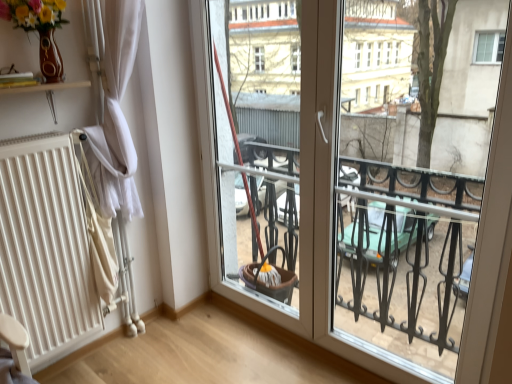
Question: Is white fabric curtain at left outside white matte radiator at left?

Choices:
 (A) no
 (B) yes

Answer: (B)

Question: Is white fabric curtain at left further to the viewer compared to white matte radiator at left?

Choices:
 (A) yes
 (B) no

Answer: (A)

Question: Considering the relative sizes of white fabric curtain at left and white matte radiator at left in the image provided, is white fabric curtain at left wider than white matte radiator at left?

Choices:
 (A) no
 (B) yes

Answer: (A)

Question: Can you confirm if white fabric curtain at left is shorter than white matte radiator at left?

Choices:
 (A) no
 (B) yes

Answer: (A)

Question: Is white fabric curtain at left oriented towards white matte radiator at left?

Choices:
 (A) yes
 (B) no

Answer: (B)

Question: From the image's perspective, is white fabric curtain at left above or below matte brown vase at upper left?

Choices:
 (A) above
 (B) below

Answer: (B)

Question: In terms of size, does white fabric curtain at left appear bigger or smaller than matte brown vase at upper left?

Choices:
 (A) small
 (B) big

Answer: (A)

Question: In terms of width, does white fabric curtain at left look wider or thinner when compared to matte brown vase at upper left?

Choices:
 (A) thin
 (B) wide

Answer: (A)

Question: From a real-world perspective, is white fabric curtain at left physically located above or below matte brown vase at upper left?

Choices:
 (A) below
 (B) above

Answer: (A)

Question: Is point (30, 236) positioned closer to the camera than point (40, 23)?

Choices:
 (A) closer
 (B) farther

Answer: (B)

Question: Considering the relative positions of white matte radiator at left and matte brown vase at upper left in the image provided, is white matte radiator at left to the left or to the right of matte brown vase at upper left?

Choices:
 (A) left
 (B) right

Answer: (A)

Question: Considering the positions of white matte radiator at left and matte brown vase at upper left in the image, is white matte radiator at left taller or shorter than matte brown vase at upper left?

Choices:
 (A) short
 (B) tall

Answer: (B)

Question: Is white matte radiator at left wider or thinner than matte brown vase at upper left?

Choices:
 (A) thin
 (B) wide

Answer: (A)

Question: In the image, is matte brown vase at upper left on the left side or the right side of white matte radiator at left?

Choices:
 (A) left
 (B) right

Answer: (B)

Question: From the image's perspective, is matte brown vase at upper left located above or below white matte radiator at left?

Choices:
 (A) above
 (B) below

Answer: (A)